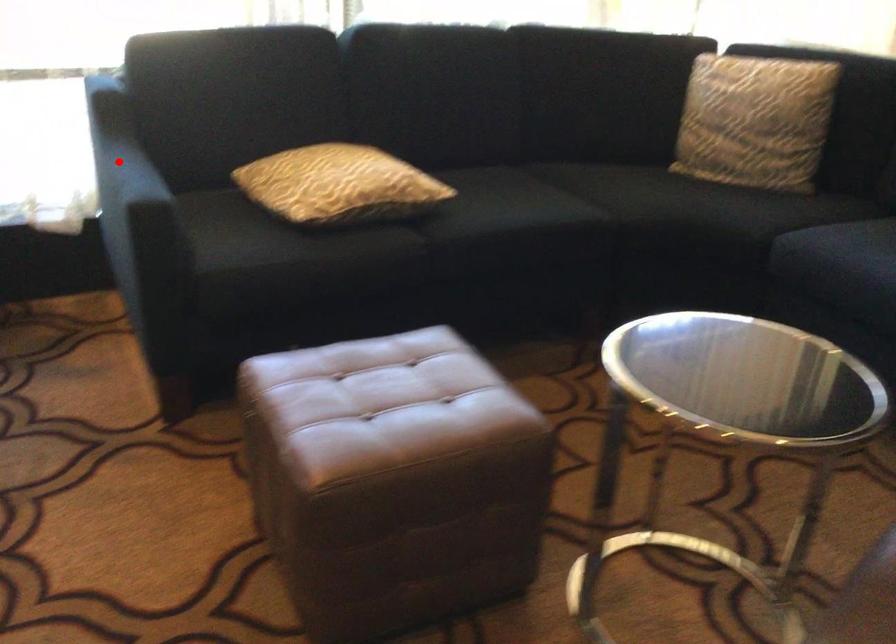
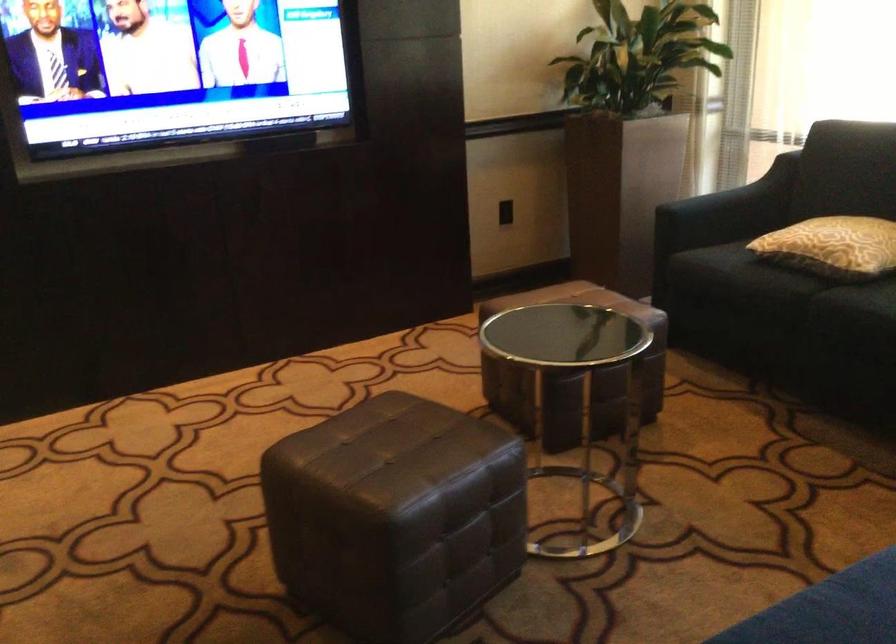
Find the pixel in the second image that matches the highlighted location in the first image.

(726, 184)